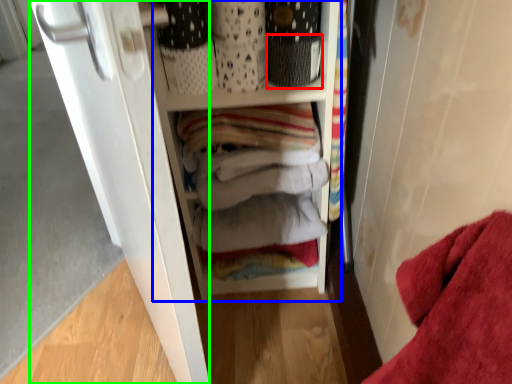
Question: Considering the real-world distances, which object is farthest from basket (highlighted by a red box)? cabinetry (highlighted by a blue box) or door (highlighted by a green box)?

Choices:
 (A) cabinetry
 (B) door

Answer: (B)